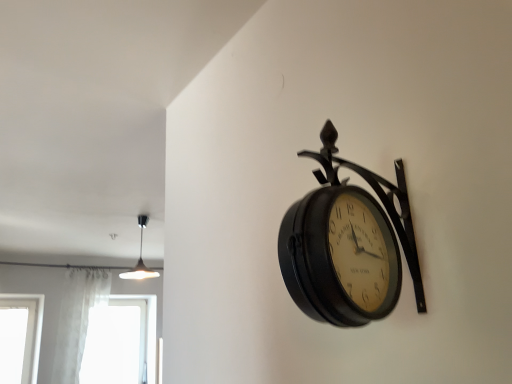
Question: Does matte black pendant light at upper left have a larger size compared to transparent glass window at lower left?

Choices:
 (A) yes
 (B) no

Answer: (B)

Question: Is matte black pendant light at upper left turned away from transparent glass window at lower left?

Choices:
 (A) no
 (B) yes

Answer: (A)

Question: Is matte black pendant light at upper left far away from transparent glass window at lower left?

Choices:
 (A) yes
 (B) no

Answer: (B)

Question: Considering the relative positions of matte black pendant light at upper left and transparent glass window at lower left in the image provided, is matte black pendant light at upper left in front of transparent glass window at lower left?

Choices:
 (A) yes
 (B) no

Answer: (A)

Question: Considering the relative sizes of matte black pendant light at upper left and transparent glass window at lower left in the image provided, is matte black pendant light at upper left smaller than transparent glass window at lower left?

Choices:
 (A) no
 (B) yes

Answer: (B)

Question: Relative to matte black clock at upper right, is white sheer curtain at lower left in front or behind?

Choices:
 (A) behind
 (B) front

Answer: (A)

Question: Is point (98, 279) positioned closer to the camera than point (399, 180)?

Choices:
 (A) farther
 (B) closer

Answer: (A)

Question: Looking at the image, does white sheer curtain at lower left seem bigger or smaller compared to matte black clock at upper right?

Choices:
 (A) big
 (B) small

Answer: (A)

Question: In terms of width, does white sheer curtain at lower left look wider or thinner when compared to matte black clock at upper right?

Choices:
 (A) wide
 (B) thin

Answer: (A)

Question: Is point (x=139, y=264) closer or farther from the camera than point (x=60, y=326)?

Choices:
 (A) closer
 (B) farther

Answer: (B)

Question: From the image's perspective, relative to white sheer curtain at lower left, is matte black pendant light at upper left above or below?

Choices:
 (A) above
 (B) below

Answer: (A)

Question: Is matte black pendant light at upper left taller or shorter than white sheer curtain at lower left?

Choices:
 (A) tall
 (B) short

Answer: (B)

Question: Would you say matte black pendant light at upper left is to the left or to the right of white sheer curtain at lower left in the picture?

Choices:
 (A) left
 (B) right

Answer: (B)

Question: In the image, is white sheer curtain at lower left positioned in front of or behind matte black pendant light at upper left?

Choices:
 (A) front
 (B) behind

Answer: (B)

Question: Does point (67, 291) appear closer or farther from the camera than point (138, 268)?

Choices:
 (A) closer
 (B) farther

Answer: (A)